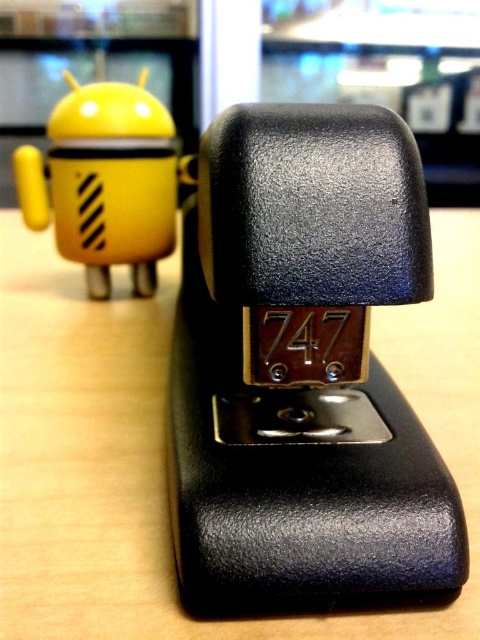
Question: Is black matte stapler at center wider than yellow matte android at left?

Choices:
 (A) yes
 (B) no

Answer: (B)

Question: Where is black matte stapler at center located in relation to yellow matte android at left in the image?

Choices:
 (A) below
 (B) above

Answer: (A)

Question: Among these points, which one is farthest from the camera?

Choices:
 (A) (135, 125)
 (B) (361, 276)

Answer: (A)

Question: Observing the image, what is the correct spatial positioning of black matte stapler at center in reference to yellow matte android at left?

Choices:
 (A) above
 (B) below

Answer: (B)